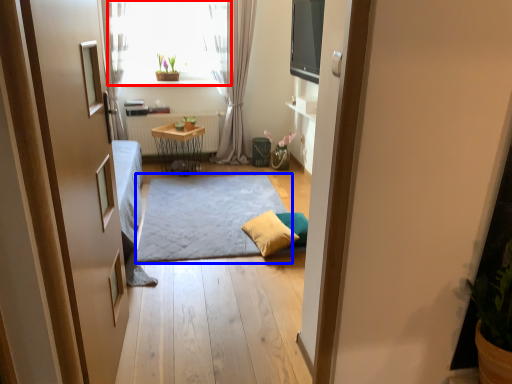
Question: Among these objects, which one is nearest to the camera, window (highlighted by a red box) or doormat (highlighted by a blue box)?

Choices:
 (A) window
 (B) doormat

Answer: (B)